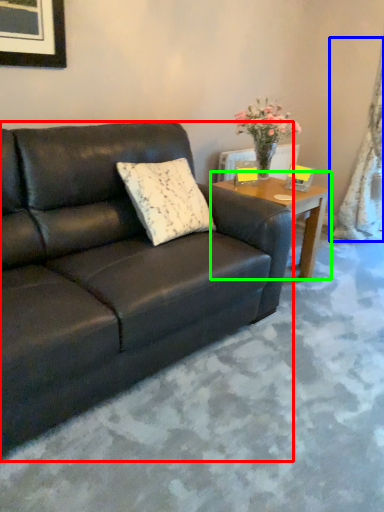
Question: Which object is the farthest from studio couch (highlighted by a red box)? Choose among these: curtain (highlighted by a blue box) or coffee table (highlighted by a green box).

Choices:
 (A) curtain
 (B) coffee table

Answer: (A)